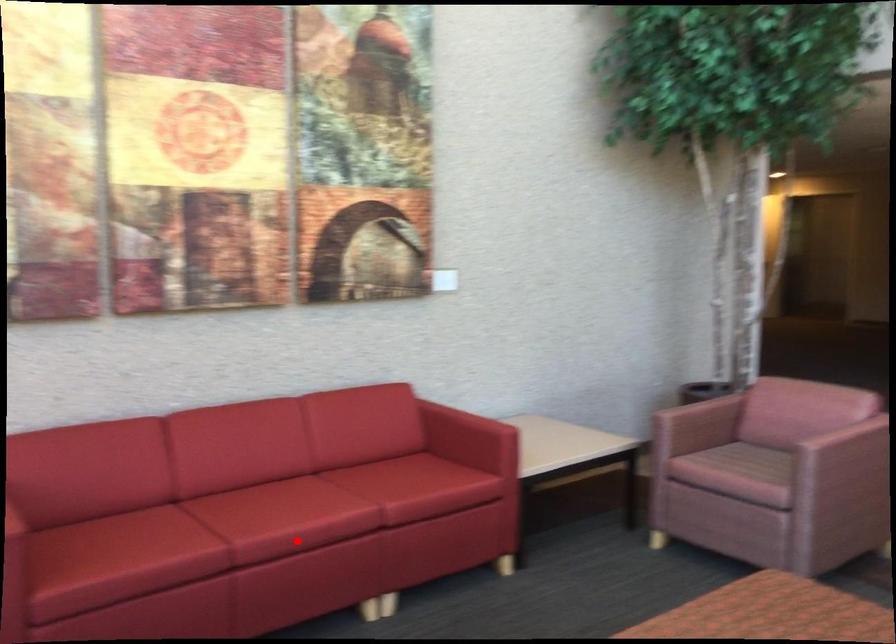
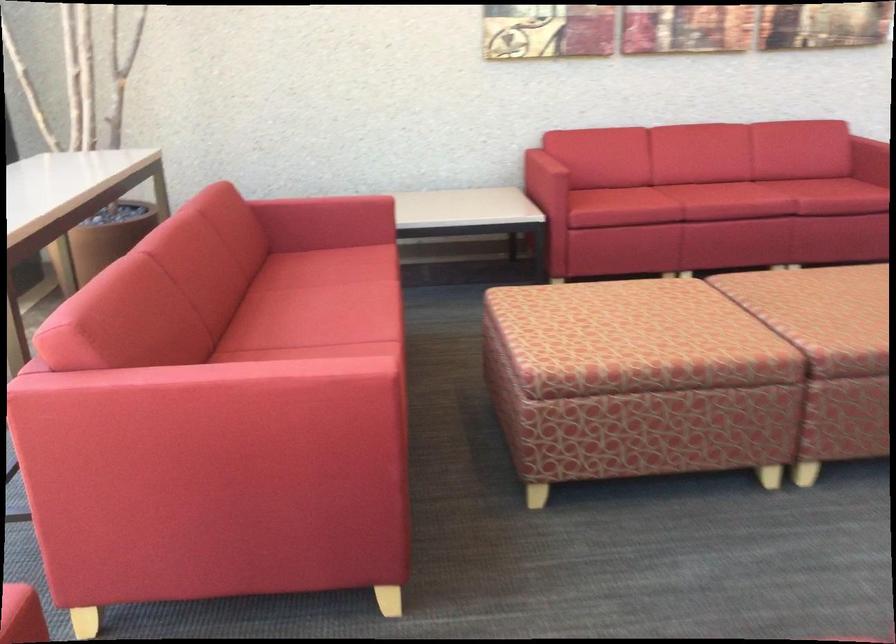
Question: I am providing you with two images of the same scene from different viewpoints. A red point is shown in image1. For the corresponding object point in image2, is it positioned nearer or farther from the camera?

Choices:
 (A) Nearer
 (B) Farther

Answer: (B)